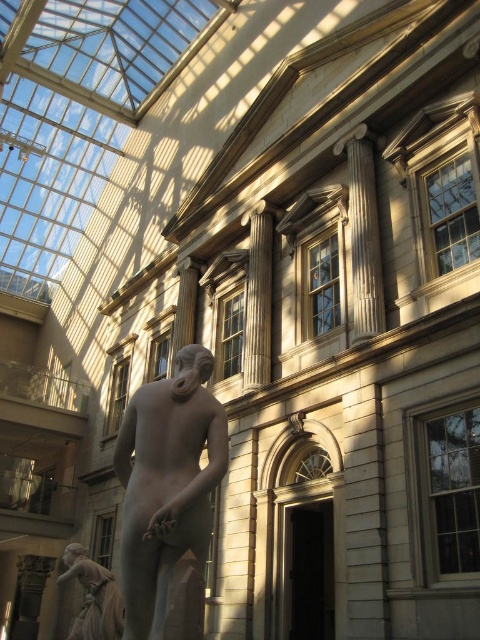
You are an art curator planning to move the matte bronze statue at lower left closer to the matte gray statue at center. Based on their current positions, which statue is currently nearer to the entrance of the room?

The matte gray statue at center is closer to the entrance because it is nearer to the viewer, implying it is positioned closer to the entrance where the observer is standing.

You are an art conservator examining the interior space. You notice a point at coordinates point (167,483). What object is located at this point?

The point (167,483) indicates the matte gray statue at center.